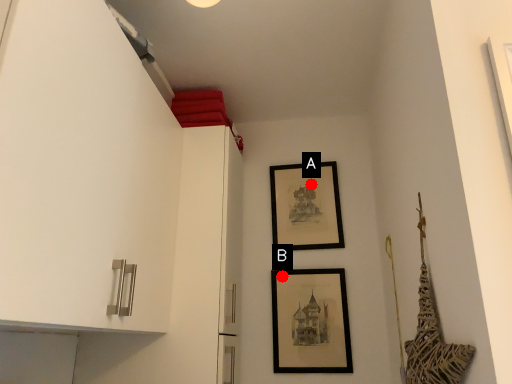
Question: Two points are circled on the image, labeled by A and B beside each circle. Which point is farther to the camera?

Choices:
 (A) A is further
 (B) B is further

Answer: (A)